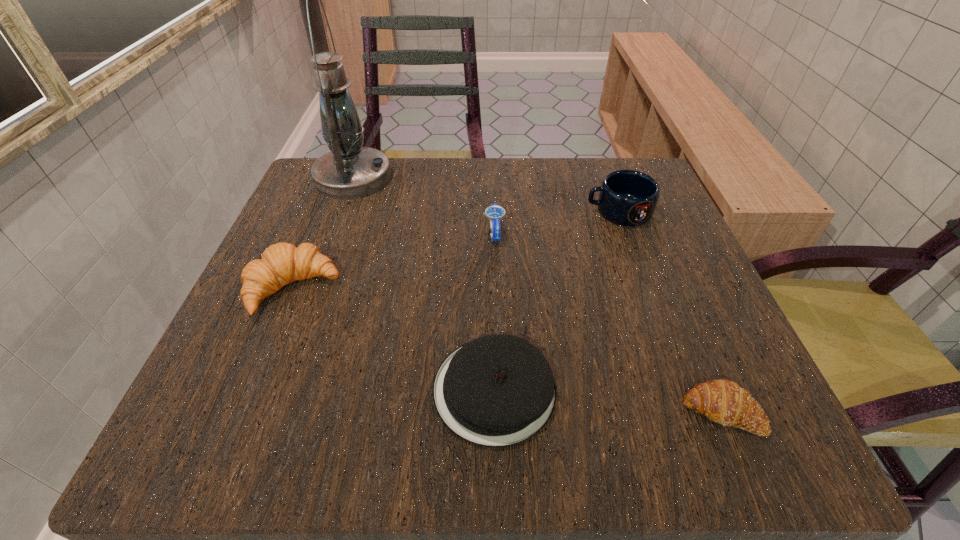
You are a GUI agent. You are given a task and a screenshot of the screen. Output one action in this format:
    pyautogui.click(x=<x>, y=<y>)
    Task: Click on the oil lamp
    This screenshot has height=540, width=960.
    Given the screenshot: What is the action you would take?
    pyautogui.click(x=350, y=171)

Locate an element on the screen. mug is located at coordinates (627, 197).

Image resolution: width=960 pixels, height=540 pixels. I want to click on the taller crescent roll, so click(x=282, y=263).

You are a GUI agent. You are given a task and a screenshot of the screen. Output one action in this format:
    pyautogui.click(x=<x>, y=<y>)
    Task: Click on the fourth farthest object
    
    Given the screenshot: What is the action you would take?
    pyautogui.click(x=282, y=263)

Where is `watch`? This screenshot has height=540, width=960. watch is located at coordinates (495, 213).

Where is `pancake`? The width and height of the screenshot is (960, 540). pancake is located at coordinates (495, 391).

At what (x,y) coordinates should I click in order to perform the action: click on the shortest object. Please return your answer as a coordinate pair (x, y). The height and width of the screenshot is (540, 960). Looking at the image, I should click on (722, 401).

The width and height of the screenshot is (960, 540). I want to click on the right crescent roll, so click(722, 401).

You are a GUI agent. You are given a task and a screenshot of the screen. Output one action in this format:
    pyautogui.click(x=<x>, y=<y>)
    Task: Click on the free space located 0.150m on the right of the oil lamp
    The image size is (960, 540).
    Given the screenshot: What is the action you would take?
    pyautogui.click(x=459, y=178)

Image resolution: width=960 pixels, height=540 pixels. Identify the location of blank space located 0.370m with the handle on the side of the mug. (403, 212).